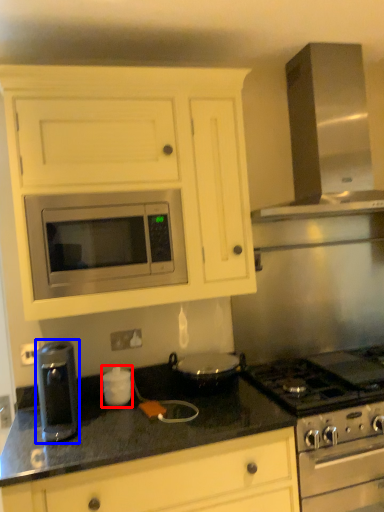
Question: Among these objects, which one is farthest to the camera, appliance (highlighted by a red box) or kitchen appliance (highlighted by a blue box)?

Choices:
 (A) appliance
 (B) kitchen appliance

Answer: (A)